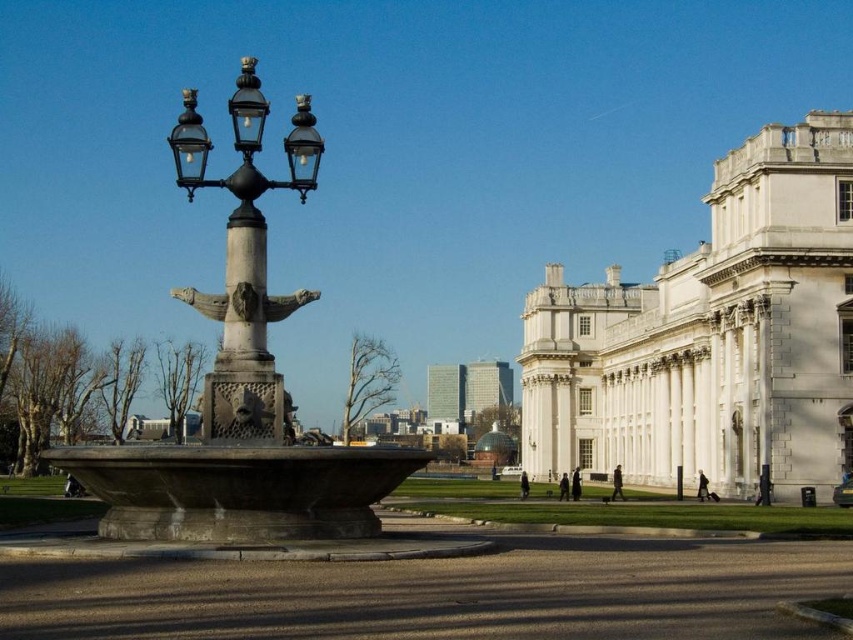
You are standing in the park and want to take a photo of the stone fountain at center. To avoid having the matte black street light at center left appear in the background, where should you position yourself relative to the fountain?

Since the stone fountain at center is below the matte black street light at center left, you should position yourself to the right of the fountain so the street light is out of frame.